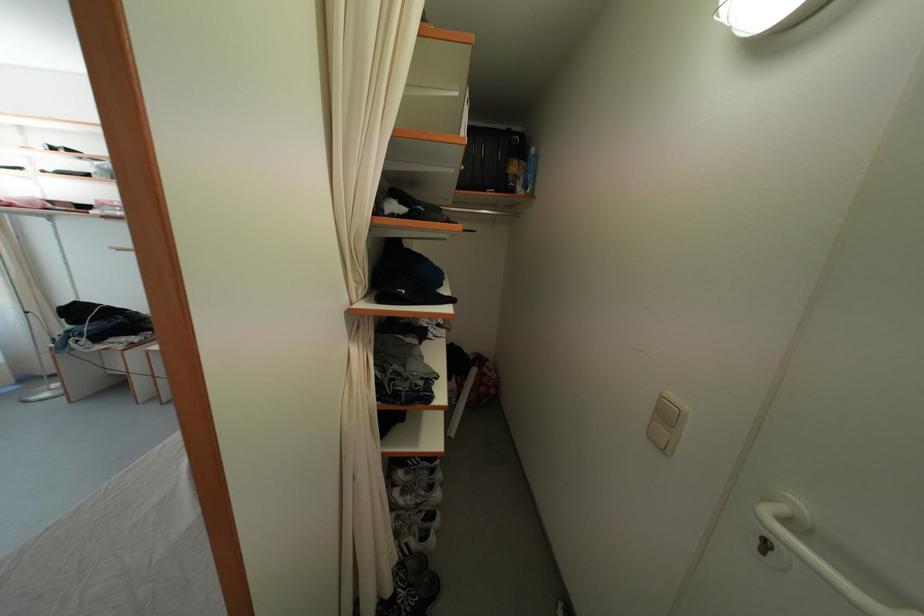
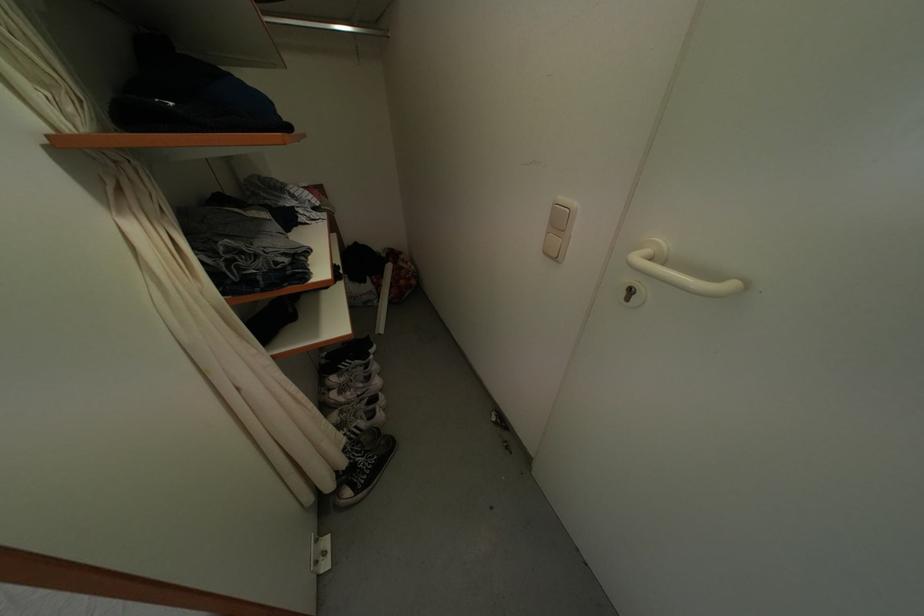
Locate, in the second image, the point that corresponds to pixel 411 549 in the first image.

(361, 432)